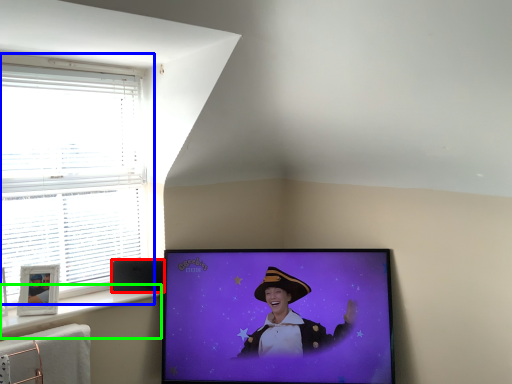
Question: Considering the real-world distances, which object is closest to speaker (highlighted by a red box)? window (highlighted by a blue box) or window sill (highlighted by a green box).

Choices:
 (A) window
 (B) window sill

Answer: (B)